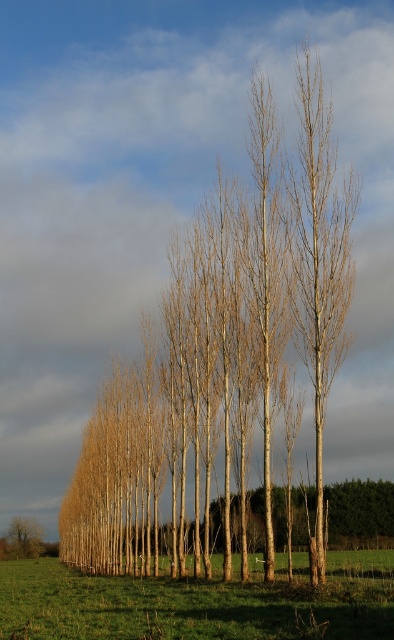
Consider the image. You are planning to plant a new tree in the field. The smooth light brown birch tree at center and the brown smooth tree at lower left are already present. Which tree has a wider trunk?

The smooth light brown birch tree at center has a wider trunk than the brown smooth tree at lower left.

You are standing in the grassy field and want to find the smooth brown tree at center. Where should you look relative to your position?

The smooth brown tree at center is located at the point with coordinates 0.550 in the x direction and 0.574 in the y direction relative to your position.

You are designing a garden layout and need to place a bench between the smooth brown tree at center and the brown smooth tree at lower left. Considering their widths, which tree should the bench be closer to for better balance?

The bench should be closer to the brown smooth tree at lower left because the smooth brown tree at center is wider, creating a natural balance when the narrower tree is positioned closer to the bench.